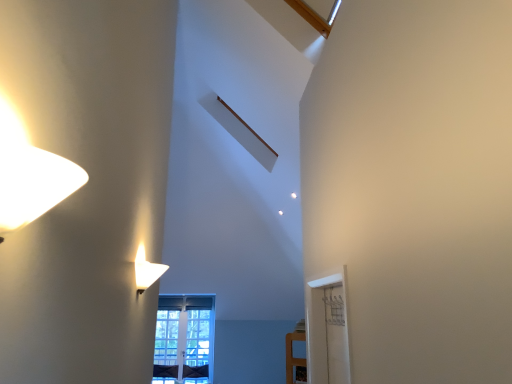
Question: Does clear glass window at center lie behind matte white lampshade at upper left?

Choices:
 (A) no
 (B) yes

Answer: (B)

Question: Is clear glass window at center thinner than matte white lampshade at upper left?

Choices:
 (A) yes
 (B) no

Answer: (A)

Question: From a real-world perspective, is clear glass window at center located beneath matte white lampshade at upper left?

Choices:
 (A) yes
 (B) no

Answer: (A)

Question: Can you confirm if clear glass window at center is wider than matte white lampshade at upper left?

Choices:
 (A) yes
 (B) no

Answer: (B)

Question: Does clear glass window at center have a larger size compared to matte white lampshade at upper left?

Choices:
 (A) yes
 (B) no

Answer: (A)

Question: Does clear glass window at center have a smaller size compared to matte white lampshade at upper left?

Choices:
 (A) no
 (B) yes

Answer: (A)

Question: Can you confirm if matte white lampshade at upper left is wider than clear glass window at center?

Choices:
 (A) no
 (B) yes

Answer: (B)

Question: Considering the relative sizes of matte white lampshade at upper left and clear glass window at center in the image provided, is matte white lampshade at upper left shorter than clear glass window at center?

Choices:
 (A) no
 (B) yes

Answer: (B)

Question: Can you confirm if matte white lampshade at upper left is thinner than clear glass window at center?

Choices:
 (A) yes
 (B) no

Answer: (B)

Question: Is matte white lampshade at upper left smaller than clear glass window at center?

Choices:
 (A) yes
 (B) no

Answer: (A)

Question: Considering the relative positions of matte white lampshade at upper left and clear glass window at center in the image provided, is matte white lampshade at upper left to the right of clear glass window at center from the viewer's perspective?

Choices:
 (A) yes
 (B) no

Answer: (A)

Question: Considering the relative sizes of matte white lampshade at upper left and clear glass window at center in the image provided, is matte white lampshade at upper left bigger than clear glass window at center?

Choices:
 (A) no
 (B) yes

Answer: (A)

Question: Based on their sizes in the image, would you say matte white lampshade at upper left is bigger or smaller than clear glass window at center?

Choices:
 (A) small
 (B) big

Answer: (A)